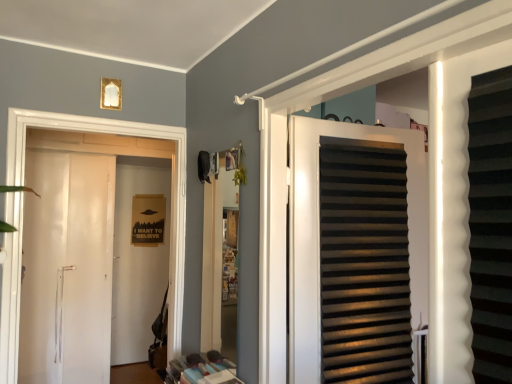
Question: From a real-world perspective, is matte black slats at center, which is the 1th door from front to back, positioned under white glossy door at left, placed as the 1th door when sorted from back to front, based on gravity?

Choices:
 (A) no
 (B) yes

Answer: (A)

Question: Does matte black slats at center, marked as the first door in a right-to-left arrangement, have a smaller size compared to white glossy door at left, placed as the 1th door when sorted from back to front?

Choices:
 (A) no
 (B) yes

Answer: (B)

Question: Is matte black slats at center, which is the 1th door from front to back, bigger than white glossy door at left, which is the 2th door from front to back?

Choices:
 (A) yes
 (B) no

Answer: (B)

Question: From a real-world perspective, is matte black slats at center, the second door when ordered from left to right, positioned over white glossy door at left, placed as the 1th door when sorted from back to front, based on gravity?

Choices:
 (A) no
 (B) yes

Answer: (B)

Question: Is matte black slats at center, marked as the first door in a right-to-left arrangement, to the right of white glossy door at left, which is the 2th door from front to back, from the viewer's perspective?

Choices:
 (A) yes
 (B) no

Answer: (A)

Question: Can you confirm if matte black slats at center, which appears as the second door when viewed from the back, is wider than white glossy door at left, placed as the 1th door when sorted from back to front?

Choices:
 (A) yes
 (B) no

Answer: (B)

Question: Is the depth of white glossy door at left, which is the 2th door from front to back, less than that of matte black slats at center, which appears as the second door when viewed from the back?

Choices:
 (A) no
 (B) yes

Answer: (A)

Question: From a real-world perspective, is white glossy door at left, placed as the 1th door when sorted from back to front, beneath matte black slats at center, which is the 1th door from front to back?

Choices:
 (A) yes
 (B) no

Answer: (A)

Question: Does white glossy door at left, which is counted as the 1th door, starting from the left, have a smaller size compared to matte black slats at center, marked as the first door in a right-to-left arrangement?

Choices:
 (A) no
 (B) yes

Answer: (A)

Question: Does white glossy door at left, which is counted as the 1th door, starting from the left, appear on the right side of matte black slats at center, which is the 1th door from front to back?

Choices:
 (A) yes
 (B) no

Answer: (B)

Question: Does white glossy door at left, placed as the 1th door when sorted from back to front, have a lesser height compared to matte black slats at center, which is the 1th door from front to back?

Choices:
 (A) yes
 (B) no

Answer: (B)

Question: Is white glossy door at left, placed as the 1th door when sorted from back to front, facing away from matte black slats at center, which appears as the second door when viewed from the back?

Choices:
 (A) yes
 (B) no

Answer: (B)

Question: From their relative heights in the image, would you say matte black slats at center, the second door when ordered from left to right, is taller or shorter than white glossy door at left, which is counted as the 2th door, starting from the right?

Choices:
 (A) tall
 (B) short

Answer: (B)